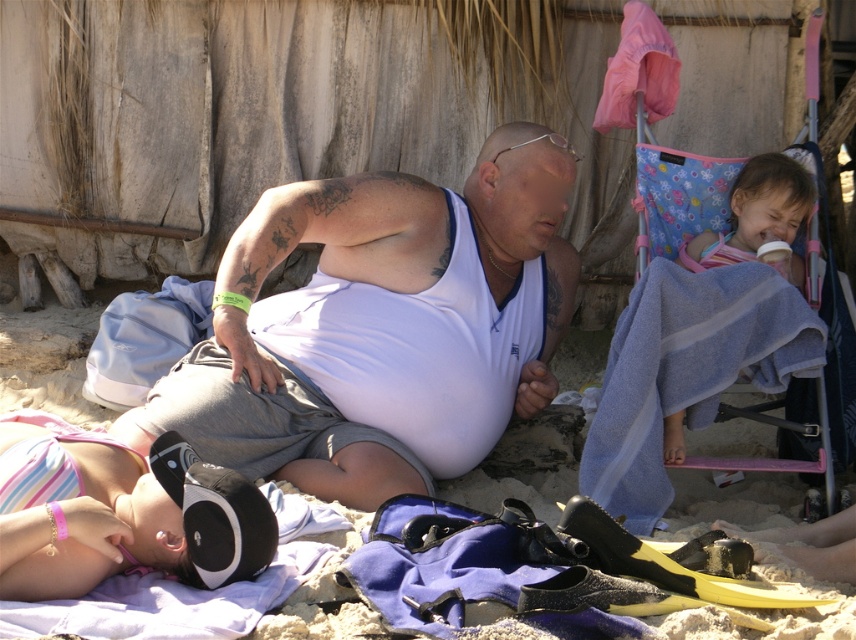
You are a lifeguard on duty at the beach. You notice a swimmer in trouble 1.2 meters away from the white matte tank top at center. The striped fabric blanket at upper right is your first aid kit. Can you reach the first aid kit before helping the swimmer?

The distance between the white matte tank top at center and the striped fabric blanket at upper right is 1.09 meters, which is less than 1.2 meters. Therefore, you can retrieve the first aid kit from the striped fabric blanket at upper right before assisting the swimmer.

Looking at this image, you are a photographer trying to capture a candid shot of the man in the white sleeveless shirt and gray shorts. You need to position yourself so that you can see both the white matte tank top at center and the white matte towel at upper center in your frame. Based on their positions, which object should be closer to the left side of your camera view?

The white matte towel at upper center is to the left of the white matte tank top at center, so the white matte towel at upper center would be closer to the left side of your camera view.